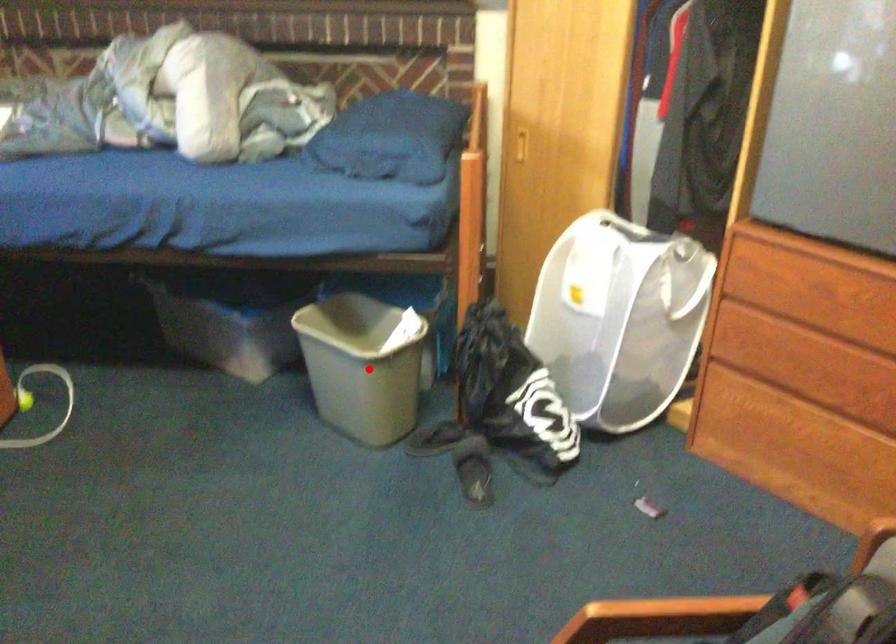
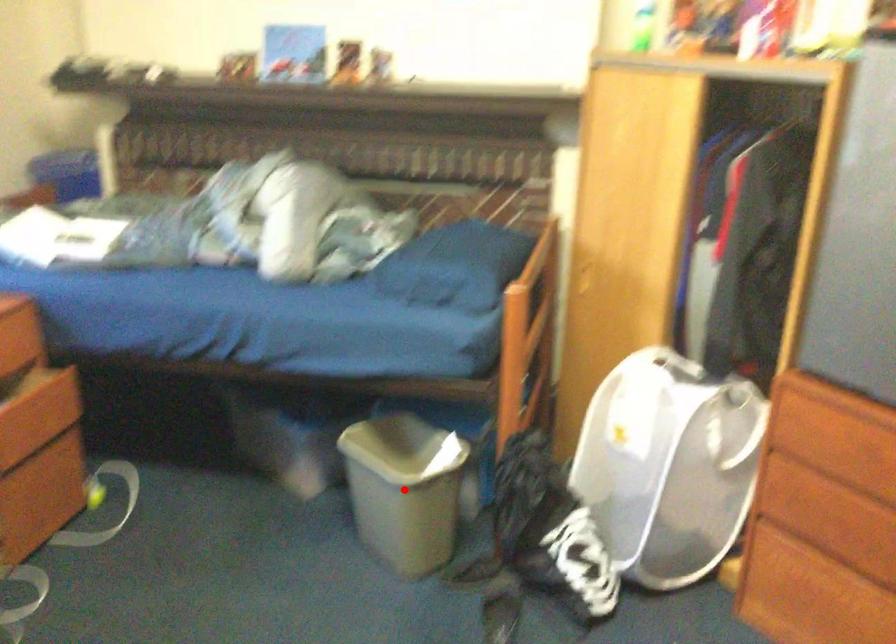
I am providing you with two images of the same scene from different viewpoints. A red point is marked on the first image and another point is marked on the second image. Is the marked point in image1 the same physical position as the marked point in image2?

Yes